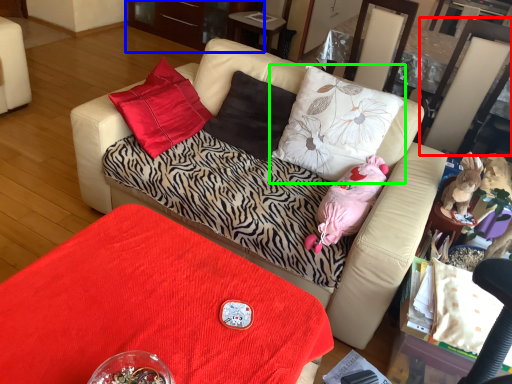
Question: Which object is the farthest from swivel chair (highlighted by a red box)? Choose among these: dresser (highlighted by a blue box) or pillow (highlighted by a green box).

Choices:
 (A) dresser
 (B) pillow

Answer: (A)